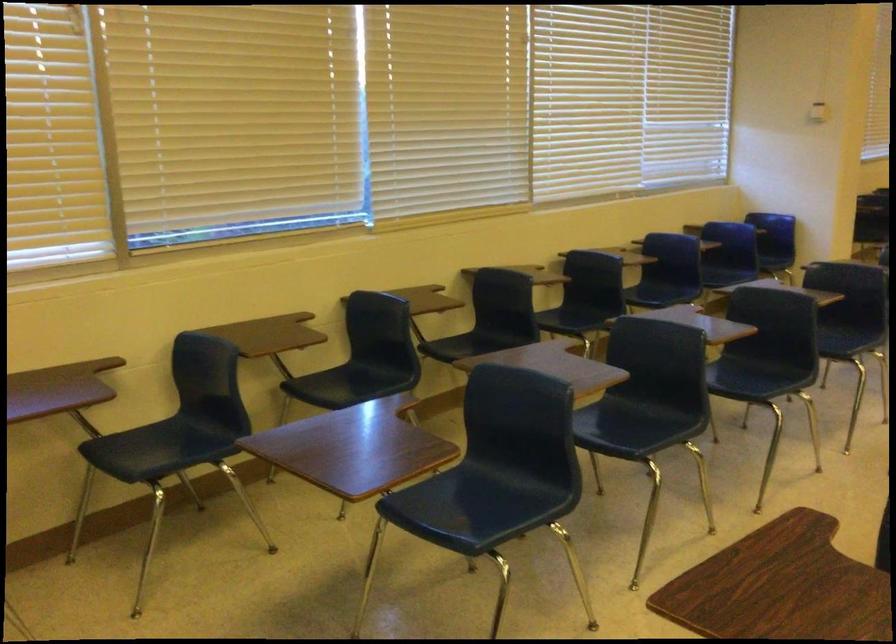
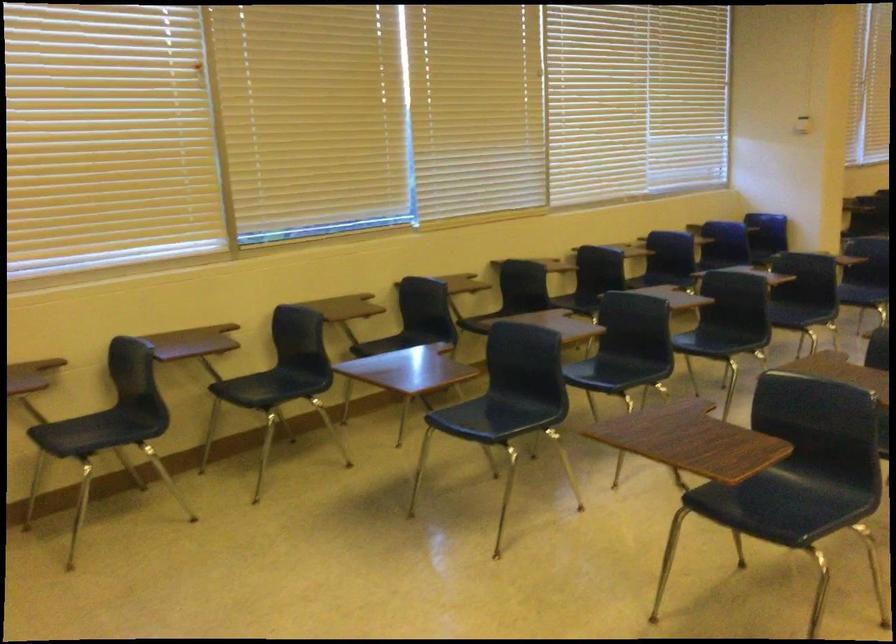
Question: Which direction would the cameraman need to move to produce the second image? Reply with the corresponding letter.

Choices:
 (A) Left
 (B) Right
 (C) Forward
 (D) Backward

Answer: (D)